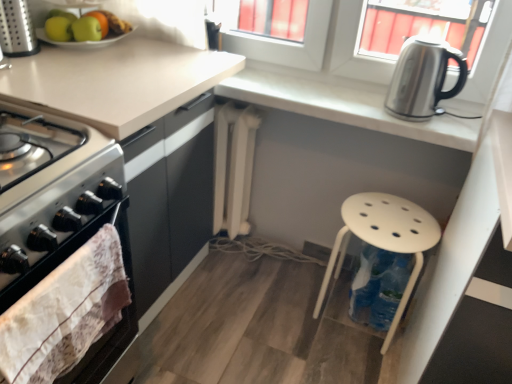
I want to click on green matte apple at upper left, the second apple in the right-to-left sequence, so click(x=86, y=29).

How much space does green matte apple at upper left, the second apple in the right-to-left sequence, occupy horizontally?

2.97 inches.

Measure the distance between green matte apple at upper left and camera.

green matte apple at upper left and camera are 4.14 feet apart.

This screenshot has height=384, width=512. I want to click on satin silver kettle at upper right, so click(422, 78).

Describe the element at coordinates (100, 21) in the screenshot. I see `green matte apple at upper left, which is counted as the 3th apple, starting from the left` at that location.

The width and height of the screenshot is (512, 384). What do you see at coordinates (233, 167) in the screenshot? I see `white matte radiator at center` at bounding box center [233, 167].

The height and width of the screenshot is (384, 512). In order to click on white fabric towel at left in this screenshot , I will do `click(65, 312)`.

Identify the location of green matte apple at upper left, the second apple in the right-to-left sequence. Image resolution: width=512 pixels, height=384 pixels. (86, 29).

Which of these two, satin silver gas stove at left or green matte apple at upper left, stands taller?

satin silver gas stove at left.

Is point (98, 214) farther from camera compared to point (80, 35)?

That is False.

Is satin silver gas stove at left turned away from green matte apple at upper left?

That's not correct — satin silver gas stove at left is not looking away from green matte apple at upper left.

Identify the location of fruit that appears above the satin silver gas stove at left (from a real-world perspective). (85, 27).

Which of these two, satin white countertop at upper right or white matte radiator at center, is bigger?

Bigger between the two is white matte radiator at center.

Looking at their sizes, would you say satin white countertop at upper right is wider or thinner than white matte radiator at center?

Clearly, satin white countertop at upper right has more width compared to white matte radiator at center.

What's the angular difference between satin white countertop at upper right and white matte radiator at center's facing directions?

The angle between the facing direction of satin white countertop at upper right and the facing direction of white matte radiator at center is 0.0554 degrees.

Are green matte apple at upper left and satin white countertop at upper right making contact?

green matte apple at upper left and satin white countertop at upper right are clearly separated.

Is green matte apple at upper left positioned in front of satin white countertop at upper right?

That is False.

Where is `fruit above the satin white countertop at upper right (from a real-world perspective)`? This screenshot has width=512, height=384. fruit above the satin white countertop at upper right (from a real-world perspective) is located at coordinates (85, 27).

Considering the relative sizes of white fabric towel at left and white matte radiator at center in the image provided, is white fabric towel at left shorter than white matte radiator at center?

Yes.

Between white fabric towel at left and white matte radiator at center, which one has larger width?

white matte radiator at center is wider.

Is white matte radiator at center a part of white fabric towel at left?

Definitely not — white matte radiator at center is not inside white fabric towel at left.

Which object is further away from the camera taking this photo, white matte radiator at center or satin white countertop at upper right?

white matte radiator at center is more distant.

Is white matte radiator at center outside of satin white countertop at upper right?

Yes, white matte radiator at center is not within satin white countertop at upper right.

Does white matte radiator at center have a lesser width compared to satin white countertop at upper right?

Yes, white matte radiator at center is thinner than satin white countertop at upper right.

Based on their positions, is satin white countertop at upper right located to the left or right of white fabric towel at left?

Based on their positions, satin white countertop at upper right is located to the right of white fabric towel at left.

From the image's perspective, is satin white countertop at upper right positioned above or below white fabric towel at left?

satin white countertop at upper right is situated higher than white fabric towel at left in the image.

Is white fabric towel at left inside satin white countertop at upper right?

Definitely not — white fabric towel at left is not inside satin white countertop at upper right.

Considering the sizes of objects satin white countertop at upper right and white fabric towel at left in the image provided, who is shorter, satin white countertop at upper right or white fabric towel at left?

satin white countertop at upper right.

Is satin silver gas stove at left next to satin white countertop at upper right and touching it?

They are not placed beside each other.

From the image's perspective, relative to satin white countertop at upper right, is satin silver gas stove at left above or below?

satin silver gas stove at left is below satin white countertop at upper right.

Considering the sizes of objects satin silver gas stove at left and satin white countertop at upper right in the image provided, who is smaller, satin silver gas stove at left or satin white countertop at upper right?

satin white countertop at upper right is smaller.

Considering the positions of point (47, 132) and point (418, 139), is point (47, 132) closer or farther from the camera than point (418, 139)?

Point (47, 132).

The height and width of the screenshot is (384, 512). Identify the location of gas stove on the left of green matte apple at upper left. (50, 185).

What are the coordinates of `radiator lying behind the satin white countertop at upper right` in the screenshot? It's located at (233, 167).

Consider the image. Estimate the real-world distances between objects in this image. Which object is further from green matte apple at upper left, white matte radiator at center or satin silver gas stove at left?

Among the two, satin silver gas stove at left is located further to green matte apple at upper left.

Which object lies nearer to the anchor point white fabric towel at left, satin white countertop at upper right or green matte apple at upper left, which is the 1th apple in left-to-right order?

green matte apple at upper left, which is the 1th apple in left-to-right order, is positioned closer to the anchor white fabric towel at left.

Based on their spatial positions, is green matte apple at upper left, the 1th apple positioned from the right, or white plastic stool at lower right further from satin white countertop at upper right?

green matte apple at upper left, the 1th apple positioned from the right, is positioned further to the anchor satin white countertop at upper right.

Estimate the real-world distances between objects in this image. Which object is further from satin silver gas stove at left, green matte apple at upper left or green matte apple at upper left, acting as the second apple starting from the left?

Among the two, green matte apple at upper left, acting as the second apple starting from the left, is located further to satin silver gas stove at left.

In the scene shown: Based on their spatial positions, is satin silver kettle at upper right or satin silver gas stove at left closer to green matte apple at upper left?

satin silver gas stove at left lies closer to green matte apple at upper left than the other object.

When comparing their distances from green matte apple at upper left, which is the 1th apple in left-to-right order, does satin silver kettle at upper right or satin silver gas stove at left seem further?

satin silver kettle at upper right is further to green matte apple at upper left, which is the 1th apple in left-to-right order.

From the picture: Looking at the image, which one is located closer to white fabric towel at left, white plastic stool at lower right or satin silver kettle at upper right?

white plastic stool at lower right is positioned closer to the anchor white fabric towel at left.

Based on their spatial positions, is green matte apple at upper left, which is the 1th apple in left-to-right order, or satin silver kettle at upper right closer to white plastic stool at lower right?

satin silver kettle at upper right.

Image resolution: width=512 pixels, height=384 pixels. I want to click on countertop located between satin silver gas stove at left and white plastic stool at lower right in the left-right direction, so click(341, 103).

The height and width of the screenshot is (384, 512). I want to click on apple between green matte apple at upper left, acting as the third apple starting from the right, and white fabric towel at left from top to bottom, so click(86, 29).

Identify the location of radiator between green matte apple at upper left and white plastic stool at lower right. (233, 167).

Locate an element on the screen. The image size is (512, 384). stool between satin silver gas stove at left and white matte radiator at center from front to back is located at coordinates (383, 234).